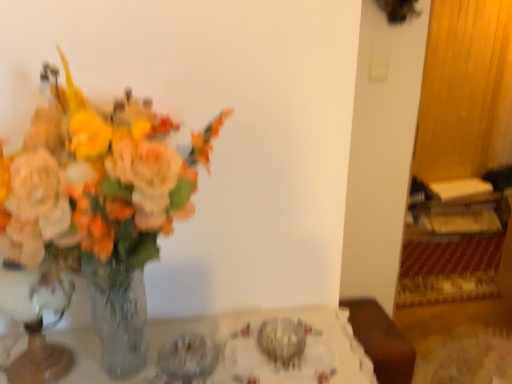
The image size is (512, 384). Identify the location of vacant area that lies to the right of clear glass vase at left. (116, 367).